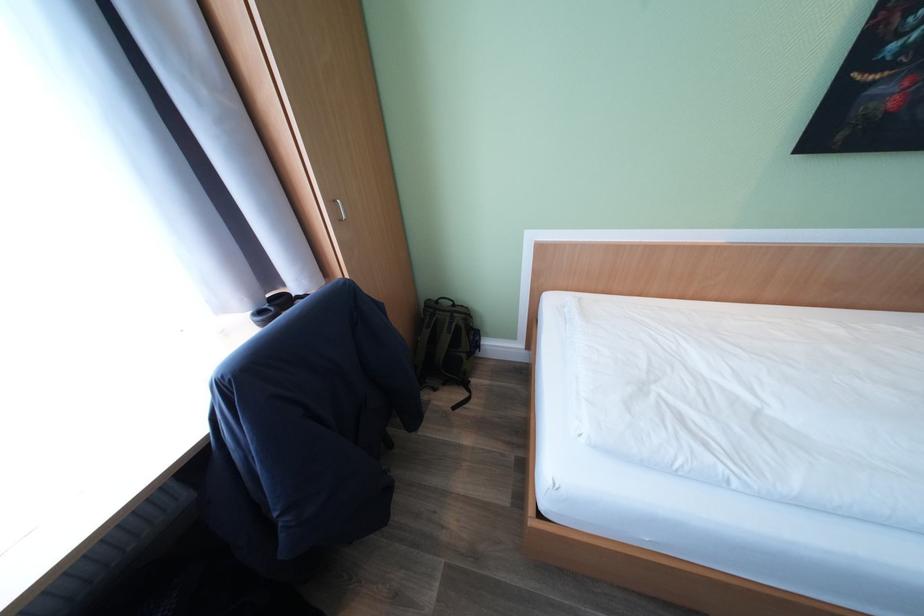
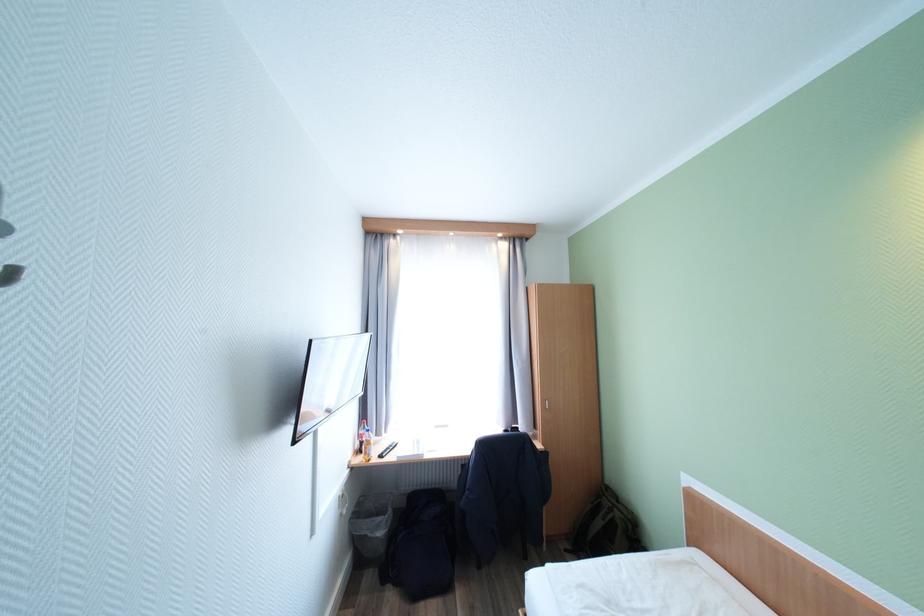
Locate, in the second image, the point that corresponds to [456,315] in the first image.

(617, 506)